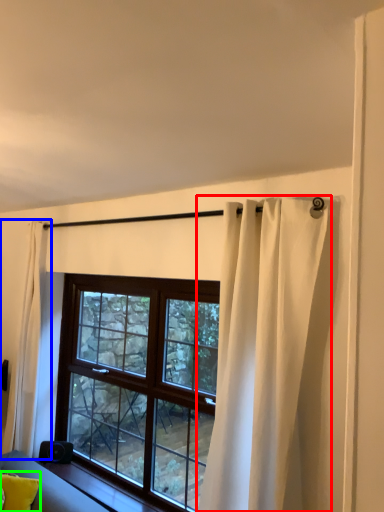
Question: Estimate the real-world distances between objects in this image. Which object is closer to curtain (highlighted by a red box), curtain (highlighted by a blue box) or pillow (highlighted by a green box)?

Choices:
 (A) curtain
 (B) pillow

Answer: (B)